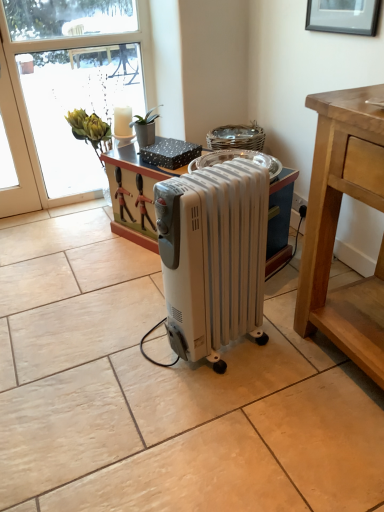
Image resolution: width=384 pixels, height=512 pixels. Find the location of `vacant region to the left of white plastic radiator at center`. vacant region to the left of white plastic radiator at center is located at coordinates (136, 351).